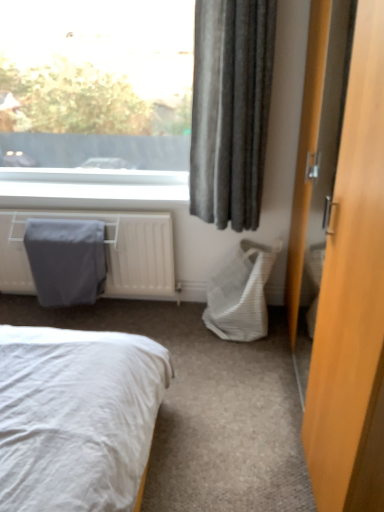
The height and width of the screenshot is (512, 384). In order to click on blank space situated above gray fabric blanket at left (from a real-world perspective) in this screenshot , I will do `click(61, 228)`.